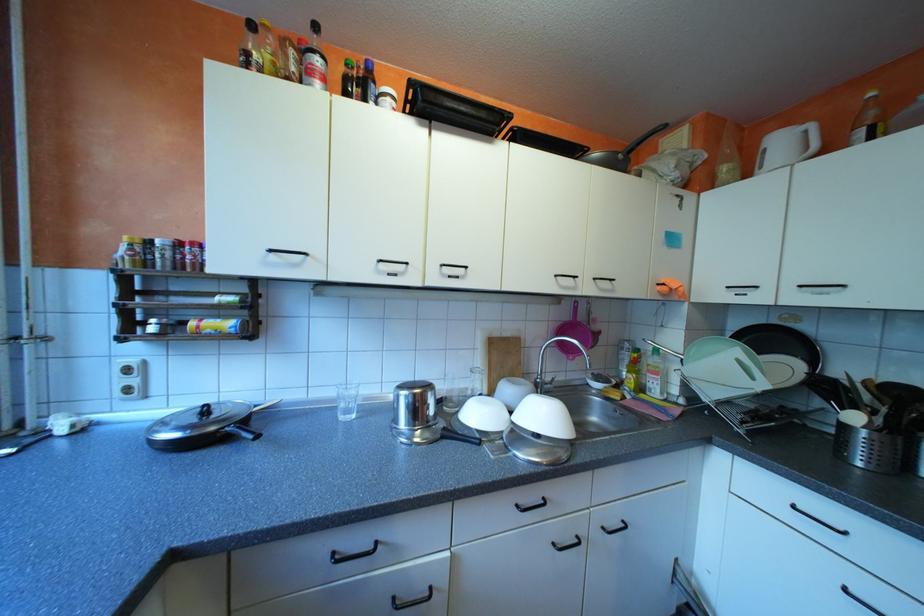
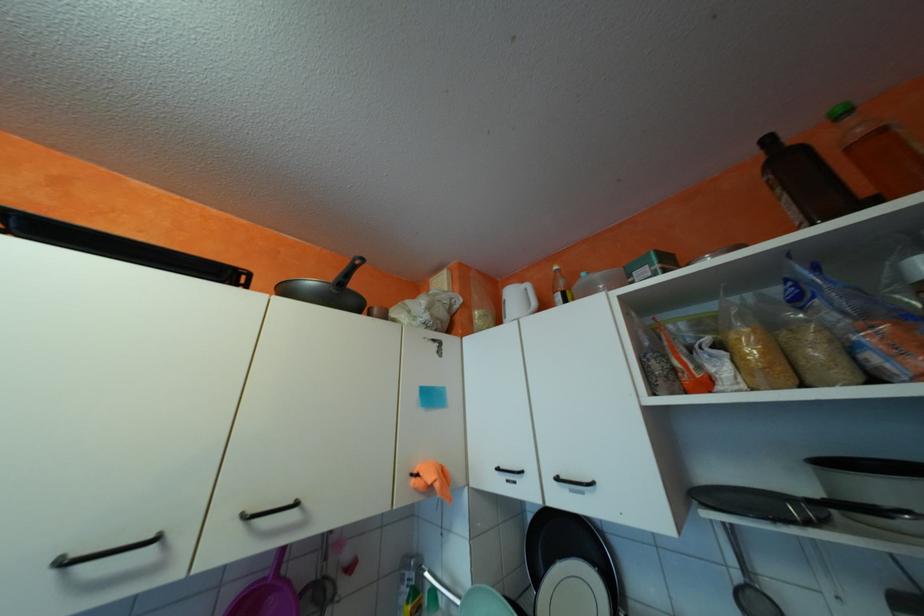
In the scene shown: Based on the continuous images, in which direction is the camera rotating?

The rotation direction of the camera is right-up.